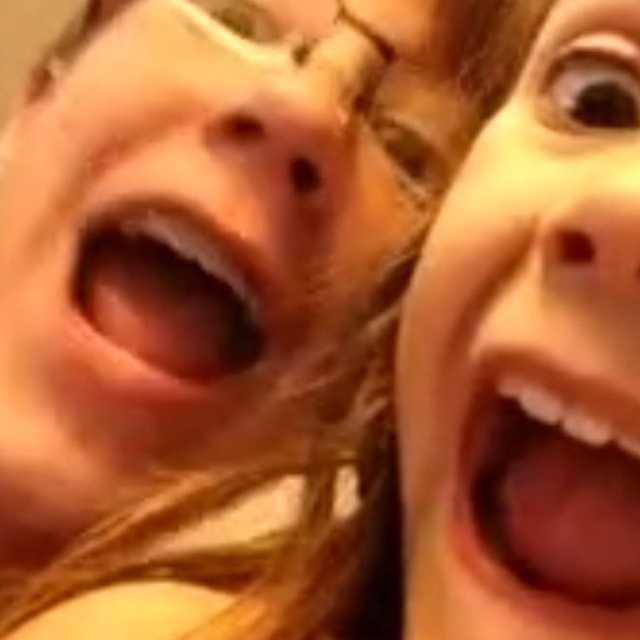
Question: Can you confirm if smooth skin face at upper right is positioned to the left of pink matte lips at center?

Choices:
 (A) no
 (B) yes

Answer: (A)

Question: Which of the following is the closest to the observer?

Choices:
 (A) (554, 596)
 (B) (532, 134)
 (C) (211, 305)

Answer: (A)

Question: Which object is closer to the camera taking this photo?

Choices:
 (A) smooth skin face at upper right
 (B) pink glossy lips at center

Answer: (A)

Question: Which object is farther from the camera taking this photo?

Choices:
 (A) smooth skin face at upper right
 (B) pink matte lips at center
 (C) pink glossy lips at center

Answer: (B)

Question: Does smooth skin face at upper right have a smaller size compared to pink matte lips at center?

Choices:
 (A) no
 (B) yes

Answer: (A)

Question: Is smooth skin face at upper right to the left of pink glossy lips at center from the viewer's perspective?

Choices:
 (A) yes
 (B) no

Answer: (A)